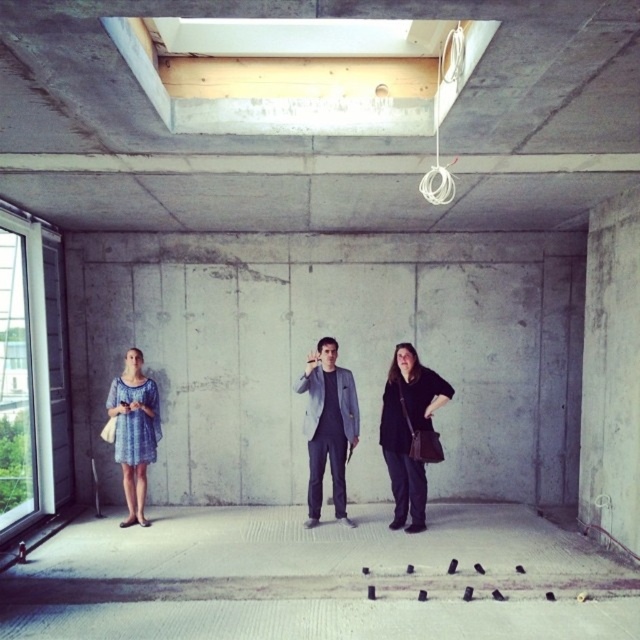
Between gray fabric suit at center and blue printed dress at left, which one appears on the right side from the viewer's perspective?

gray fabric suit at center is more to the right.

Find the location of a particular element. The image size is (640, 640). gray fabric suit at center is located at coordinates (328, 426).

In the scene shown: Who is more distant from viewer, (444, 385) or (314, 465)?

Point (314, 465)

Is point (394, 476) farther from camera compared to point (333, 472)?

That is False.

Locate an element on the screen. The height and width of the screenshot is (640, 640). black leather jacket at lower right is located at coordinates (410, 433).

Is black leather jacket at lower right closer to camera compared to blue printed dress at left?

Yes, black leather jacket at lower right is closer to the viewer.

Who is more forward, (x=403, y=490) or (x=131, y=358)?

Point (x=403, y=490) is in front.

Does point (380, 413) lie in front of point (132, 376)?

No, it is not.

This screenshot has height=640, width=640. I want to click on black leather jacket at lower right, so 410,433.